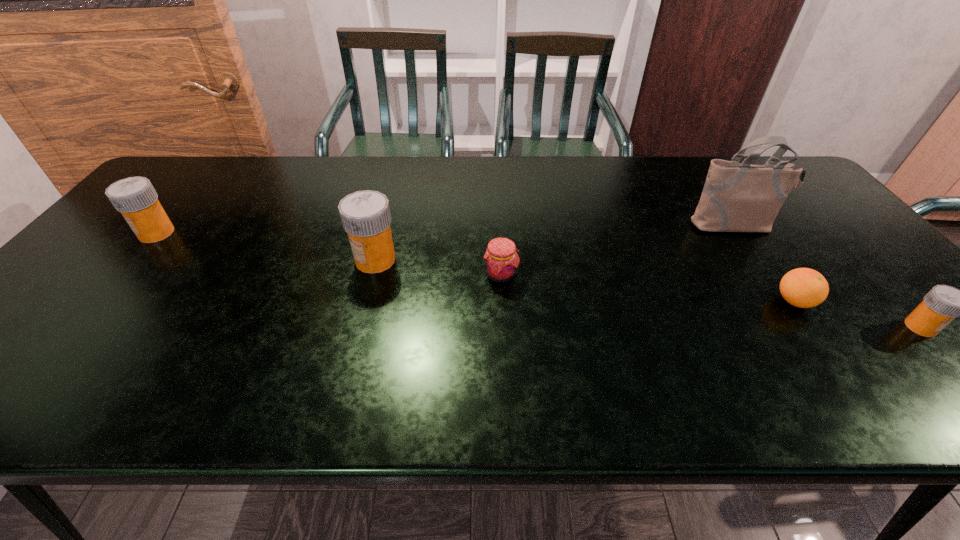
In order to click on vacant space located 0.050m on the label side of the farthest medicine in this screenshot , I will do `click(121, 233)`.

Locate an element on the screen. The width and height of the screenshot is (960, 540). vacant region located 0.080m on the label side of the second farthest medicine is located at coordinates (323, 260).

Find the location of a particular element. This screenshot has width=960, height=540. vacant space located on the label side of the second farthest medicine is located at coordinates (300, 260).

This screenshot has height=540, width=960. In order to click on vacant area located 0.370m on the label side of the second farthest medicine in this screenshot , I will do `click(211, 260)`.

Locate an element on the screen. The width and height of the screenshot is (960, 540). blank area located on the label side of the nearest medicine is located at coordinates (952, 361).

I want to click on free spot located 0.200m on the right of the orange, so click(899, 301).

Identify the location of vacant space located on the right of the fourth object from right to left. (579, 274).

You are a GUI agent. You are given a task and a screenshot of the screen. Output one action in this format:
    pyautogui.click(x=<x>, y=<y>)
    Task: Click on the vacant area situated 0.180m on the front-facing side of the shoulder bag
    This screenshot has height=540, width=960.
    Given the screenshot: What is the action you would take?
    pyautogui.click(x=774, y=284)

The height and width of the screenshot is (540, 960). I want to click on object located at the near edge, so click(942, 304).

Locate an element on the screen. The height and width of the screenshot is (540, 960). object present at the left edge is located at coordinates (135, 197).